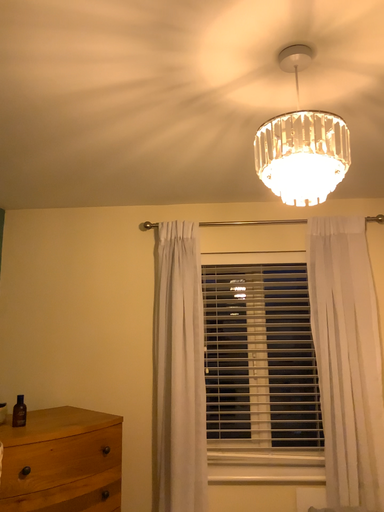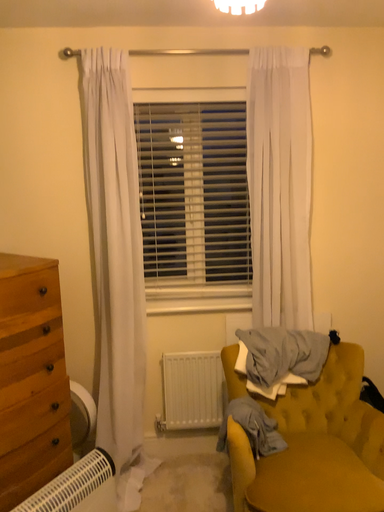
Question: How did the camera likely rotate when shooting the video?

Choices:
 (A) rotated left
 (B) rotated right

Answer: (B)